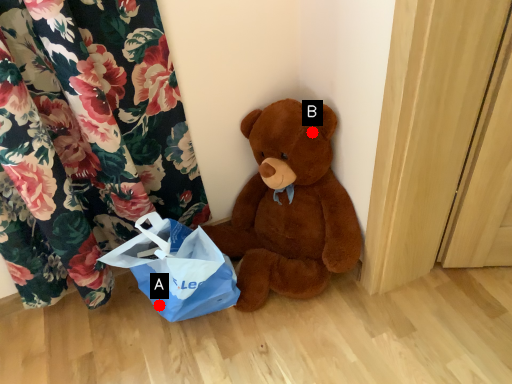
Question: Two points are circled on the image, labeled by A and B beside each circle. Which of the following is the closest to the observer?

Choices:
 (A) A is closer
 (B) B is closer

Answer: (B)